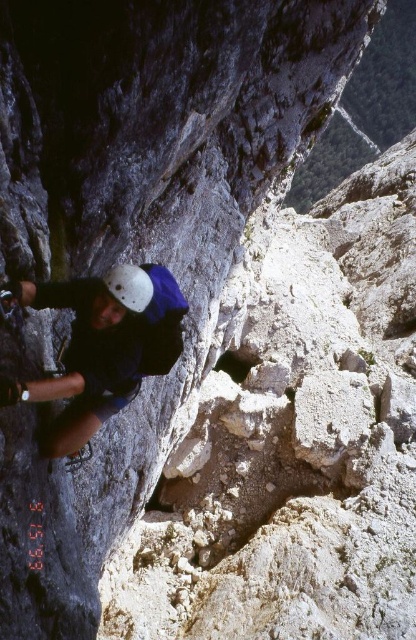
You are a climber looking at the rock face. There are two points marked on the rock face, point 1 at coordinates point (69,452) and point 2 at coordinates point (136,276). Which point is closer to you?

Point (69,452) is further to the camera than point (136,276), so point (136,276) is closer to you.

You are a rock climbing instructor observing a climber on a steep rock face. You notice two helmets in the scene. The climber is wearing the matte white helmet at left, and there is another white matte helmet at upper left. Which helmet is larger in size?

The matte white helmet at left is larger in size compared to the white matte helmet at upper left.